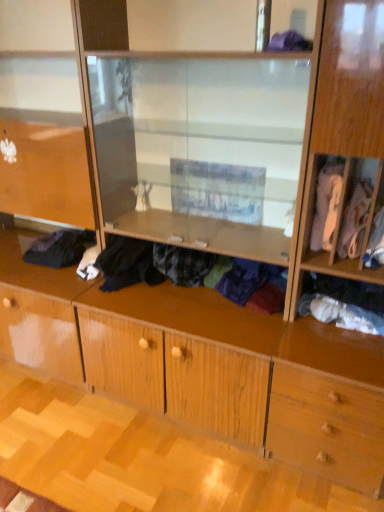
Question: From a real-world perspective, is purple fabric at upper center, the 5th clothing positioned from the right, positioned over white fabric at lower right, which appears as the 2th clothing when viewed from the right, based on gravity?

Choices:
 (A) no
 (B) yes

Answer: (B)

Question: Can you confirm if purple fabric at upper center, which appears as the 3th clothing when viewed from the left, is bigger than white fabric at lower right, which is counted as the 6th clothing, starting from the left?

Choices:
 (A) yes
 (B) no

Answer: (B)

Question: Would you say purple fabric at upper center, the 5th clothing positioned from the right, is a long distance from white fabric at lower right, which appears as the 2th clothing when viewed from the right?

Choices:
 (A) no
 (B) yes

Answer: (A)

Question: Does purple fabric at upper center, the 5th clothing positioned from the right, have a greater height compared to white fabric at lower right, which appears as the 2th clothing when viewed from the right?

Choices:
 (A) no
 (B) yes

Answer: (A)

Question: Does purple fabric at upper center, which appears as the 3th clothing when viewed from the left, have a lesser width compared to white fabric at lower right, which appears as the 2th clothing when viewed from the right?

Choices:
 (A) no
 (B) yes

Answer: (A)

Question: From the image's perspective, is black fabric at lower left, positioned as the 7th clothing in right-to-left order, located above or below purple fabric at upper center, which appears as the 3th clothing when viewed from the left?

Choices:
 (A) below
 (B) above

Answer: (A)

Question: Does point (36, 250) appear closer or farther from the camera than point (274, 40)?

Choices:
 (A) closer
 (B) farther

Answer: (B)

Question: Would you say black fabric at lower left, positioned as the 7th clothing in right-to-left order, is to the left or to the right of purple fabric at upper center, which appears as the 3th clothing when viewed from the left, in the picture?

Choices:
 (A) right
 (B) left

Answer: (B)

Question: From a real-world perspective, relative to purple fabric at upper center, the 5th clothing positioned from the right, is black fabric at lower left, positioned as the 7th clothing in right-to-left order, vertically above or below?

Choices:
 (A) below
 (B) above

Answer: (A)

Question: From a real-world perspective, is white cotton shirt at right, the first clothing positioned from the right, positioned above or below white fabric at lower right, which appears as the 2th clothing when viewed from the right?

Choices:
 (A) above
 (B) below

Answer: (A)

Question: Is white cotton shirt at right, the first clothing positioned from the right, inside or outside of white fabric at lower right, which is counted as the 6th clothing, starting from the left?

Choices:
 (A) inside
 (B) outside

Answer: (B)

Question: Considering the relative positions of white cotton shirt at right, the first clothing positioned from the right, and white fabric at lower right, which appears as the 2th clothing when viewed from the right, in the image provided, is white cotton shirt at right, the first clothing positioned from the right, to the left or to the right of white fabric at lower right, which appears as the 2th clothing when viewed from the right,?

Choices:
 (A) left
 (B) right

Answer: (B)

Question: Is white cotton shirt at right, the first clothing positioned from the right, in front of or behind white fabric at lower right, which is counted as the 6th clothing, starting from the left, in the image?

Choices:
 (A) behind
 (B) front

Answer: (B)

Question: Is point (352, 228) closer or farther from the camera than point (56, 241)?

Choices:
 (A) farther
 (B) closer

Answer: (B)

Question: From the image's perspective, is white fabric at right, which is the fifth clothing from left to right, positioned above or below black fabric at lower left, which appears as the 1th clothing when viewed from the left?

Choices:
 (A) above
 (B) below

Answer: (A)